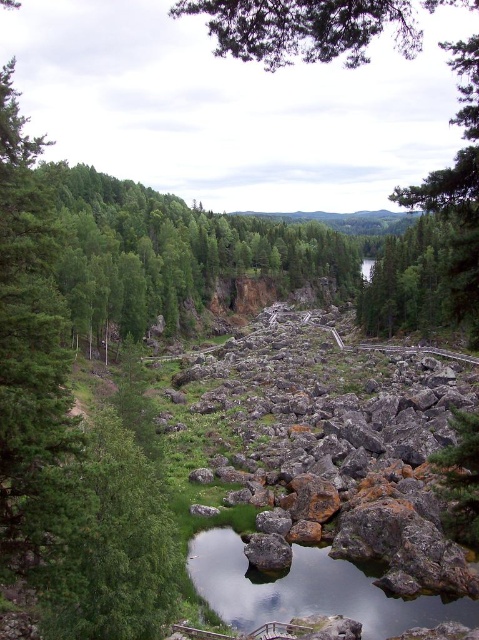
You are a hiker who needs to cross the path in the middle ground. The path is bordered by wooden railings. You see the rusty metallic rocks at center and the clear water at center. Which object is higher in elevation?

The rusty metallic rocks at center are much taller than the clear water at center, so the rusty metallic rocks at center are higher in elevation.